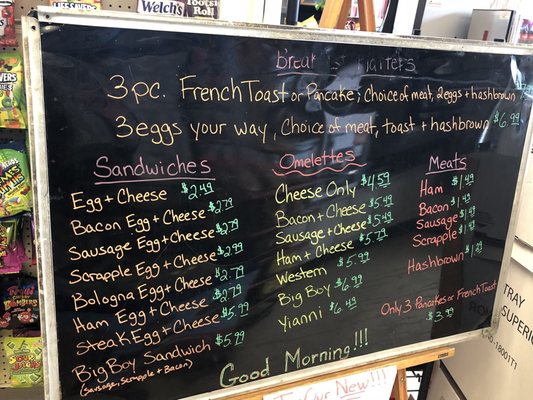
The width and height of the screenshot is (533, 400). In order to click on metal frame in this screenshot , I will do `click(64, 20)`, `click(35, 81)`, `click(323, 376)`.